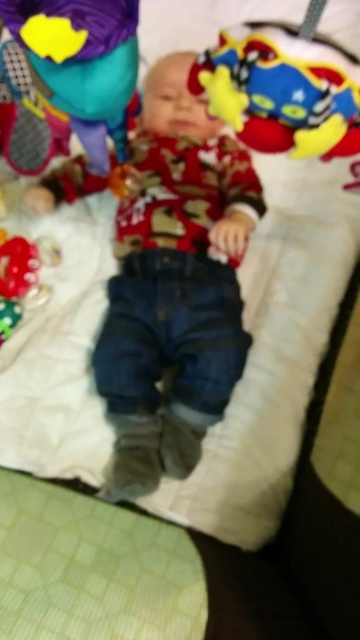
Question: Which point is farther from the camera taking this photo?

Choices:
 (A) (15, 28)
 (B) (293, 36)

Answer: (A)

Question: Which of the following is the farthest from the observer?

Choices:
 (A) soft plush toy at upper right
 (B) matte green plush toy at upper left

Answer: (B)

Question: Where is soft plush toy at upper right located in relation to matte green plush toy at upper left in the image?

Choices:
 (A) right
 (B) left

Answer: (A)

Question: Which of the following is the closest to the observer?

Choices:
 (A) soft plush toy at upper right
 (B) matte green plush toy at upper left

Answer: (A)

Question: Observing the image, what is the correct spatial positioning of soft plush toy at upper right in reference to matte green plush toy at upper left?

Choices:
 (A) below
 (B) above

Answer: (A)

Question: Does soft plush toy at upper right appear over matte green plush toy at upper left?

Choices:
 (A) no
 (B) yes

Answer: (A)